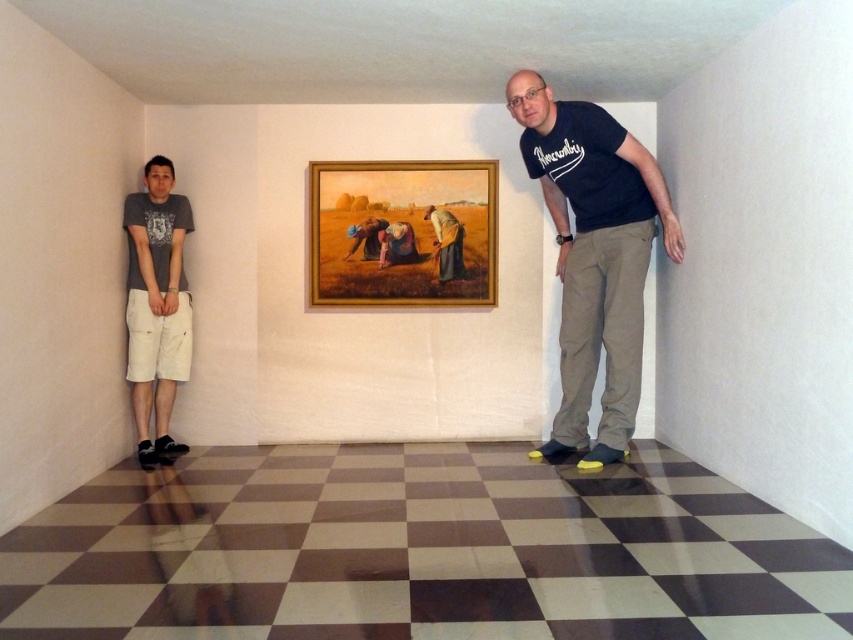
Question: Does black cotton t-shirt at right have a greater width compared to brown textured fabric at center?

Choices:
 (A) no
 (B) yes

Answer: (B)

Question: Can you confirm if wooden frame at center is thinner than matte gray t-shirt at left?

Choices:
 (A) yes
 (B) no

Answer: (B)

Question: Which point is farther from the camera taking this photo?

Choices:
 (A) (165, 330)
 (B) (444, 232)
 (C) (318, 266)
 (D) (598, 200)

Answer: (B)

Question: Which object is farther from the camera taking this photo?

Choices:
 (A) black cotton t-shirt at right
 (B) matte gray t-shirt at left

Answer: (B)

Question: Which point is farther to the camera?

Choices:
 (A) black cotton t-shirt at right
 (B) wooden frame at center
 (C) brown textured fabric at center
 (D) matte gray t-shirt at left

Answer: (C)

Question: Considering the relative positions of wooden frame at center and brown textured fabric at center in the image provided, where is wooden frame at center located with respect to brown textured fabric at center?

Choices:
 (A) left
 (B) right

Answer: (A)